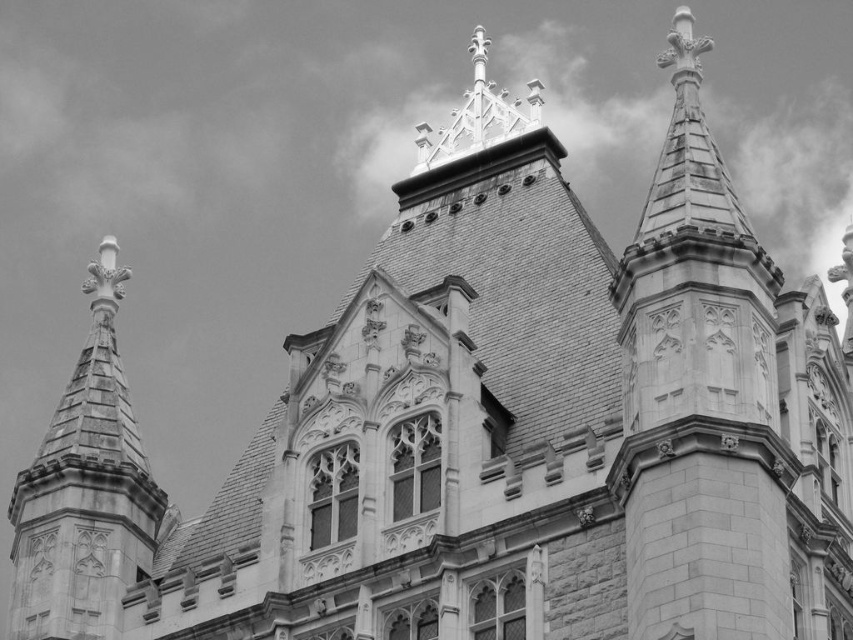
You are a drone operator tasked with capturing aerial footage of the building. The white stone steeple at upper right and the stone spire at left are both important landmarks. If your drone can only travel 30 meters before needing to recharge, can it fly from one to the other without needing to recharge?

The white stone steeple at upper right is 31.53 meters away from the stone spire at left. Since the distance exceeds the drone travel limit of 30 meters, the drone cannot fly between them without recharging.

You are an architect analyzing the structural integrity of the building. You notice the white stone steeple at upper right and the stone spire at left. Which of these two structures might be more prone to wind resistance issues based on their thickness?

The white stone steeple at upper right is thinner than the stone spire at left, making it more prone to wind resistance issues due to its narrower structure.

You are an architect examining this Gothic Revival building. You notice the white stone steeple at upper right and the stone spire at left. Based on their heights, which one would require more materials for a restoration project?

The stone spire at left requires more materials for restoration since it is taller than the white stone steeple at upper right.